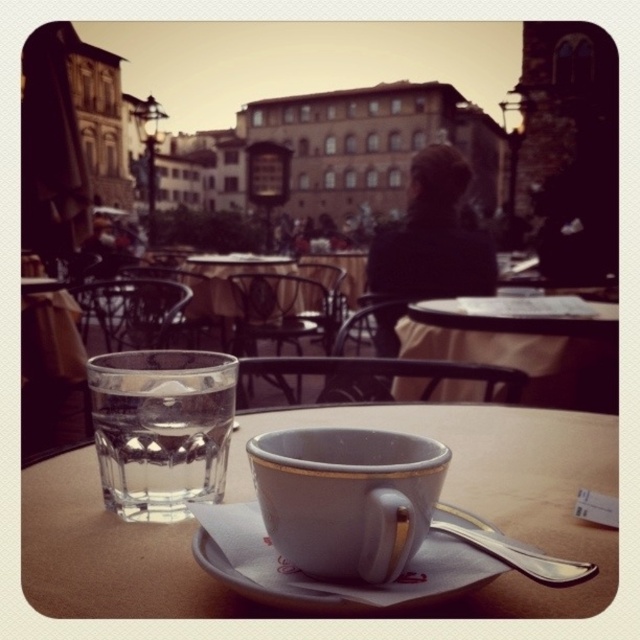
Question: Among these points, which one is nearest to the camera?

Choices:
 (A) (344, 454)
 (B) (600, 333)

Answer: (A)

Question: Which is nearer to the matte ceramic cup at center?

Choices:
 (A) white ceramic cup at center
 (B) white ceramic saucer at center

Answer: (B)

Question: Does clear glass at left have a smaller size compared to white ceramic table at center?

Choices:
 (A) yes
 (B) no

Answer: (A)

Question: Is matte ceramic cup at center thinner than white ceramic saucer at center?

Choices:
 (A) no
 (B) yes

Answer: (B)

Question: Among these points, which one is farthest from the camera?

Choices:
 (A) [x=493, y=317]
 (B) [x=141, y=356]

Answer: (A)

Question: Does matte ceramic cup at center have a smaller size compared to white ceramic saucer at center?

Choices:
 (A) yes
 (B) no

Answer: (A)